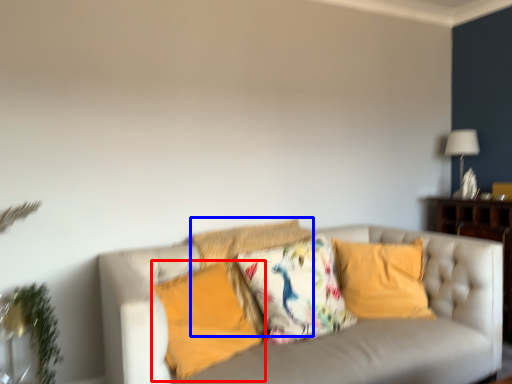
Question: Which point is closer to the camera, pillow (highlighted by a red box) or pillow (highlighted by a blue box)?

Choices:
 (A) pillow
 (B) pillow

Answer: (A)